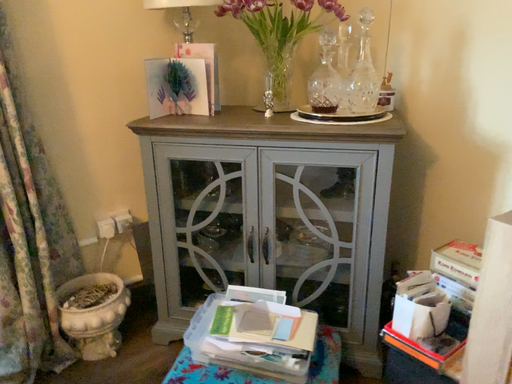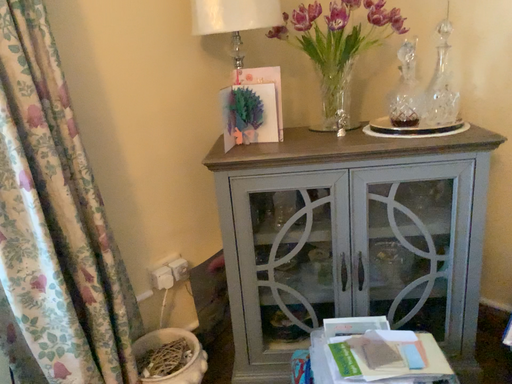
Question: How did the camera likely rotate when shooting the video?

Choices:
 (A) rotated right
 (B) rotated left

Answer: (A)